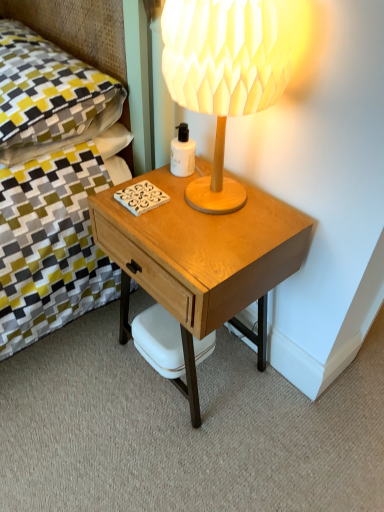
Where is `vacant space in front of light brown wood desk at center`? vacant space in front of light brown wood desk at center is located at coordinates (183, 457).